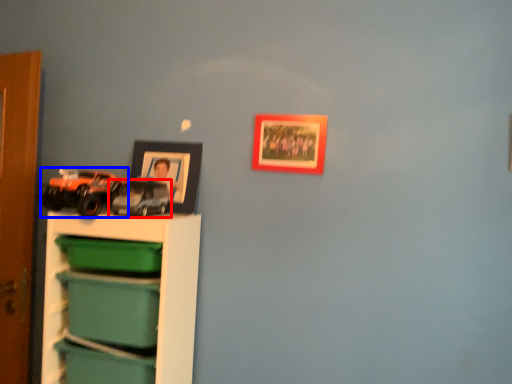
Question: Which point is further to the camera, toy (highlighted by a red box) or toy (highlighted by a blue box)?

Choices:
 (A) toy
 (B) toy

Answer: (A)